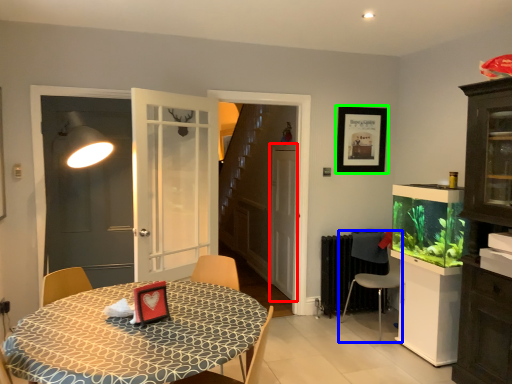
Question: Which object is positioned closest to screen door (highlighted by a red box)? Select from chair (highlighted by a blue box) and picture frame (highlighted by a green box).

Choices:
 (A) chair
 (B) picture frame

Answer: (B)